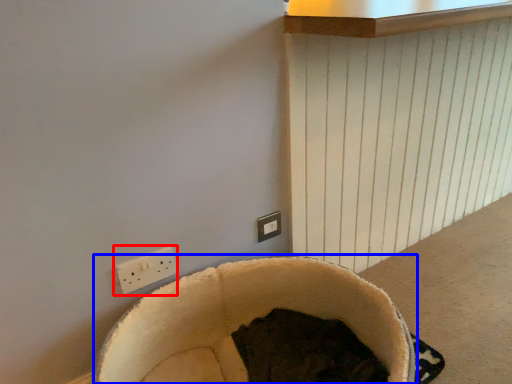
Question: Among these objects, which one is nearest to the camera, power plugs and sockets (highlighted by a red box) or bean bag chair (highlighted by a blue box)?

Choices:
 (A) power plugs and sockets
 (B) bean bag chair

Answer: (B)